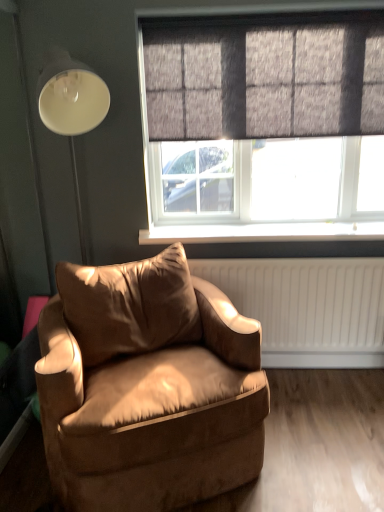
Find the location of a particular element. Image resolution: width=384 pixels, height=512 pixels. textured gray window at upper center is located at coordinates (265, 136).

The image size is (384, 512). What do you see at coordinates (265, 79) in the screenshot?
I see `dark grey textured curtain at upper center` at bounding box center [265, 79].

Measure the distance between dark grey textured curtain at upper center and camera.

dark grey textured curtain at upper center is 7.21 feet away from camera.

In order to face white plastic window sill at center, should I rotate leftwards or rightwards?

It's best to rotate right around 9.754 degrees.

Identify the location of suede-like brown armchair at lower left. The height and width of the screenshot is (512, 384). (148, 387).

Identify the location of window on the right side of white plastic window sill at center. Image resolution: width=384 pixels, height=512 pixels. (265, 136).

Which object is closer to the camera, white plastic window sill at center or textured gray window at upper center?

textured gray window at upper center is more forward.

From the picture: Can you confirm if white plastic window sill at center is smaller than textured gray window at upper center?

Indeed, white plastic window sill at center has a smaller size compared to textured gray window at upper center.

How distant is white plastic window sill at center from textured gray window at upper center?

A distance of 16.14 inches exists between white plastic window sill at center and textured gray window at upper center.

Are white plastic window sill at center and dark grey textured curtain at upper center making contact?

No, white plastic window sill at center is not touching dark grey textured curtain at upper center.

Which is closer, (150, 244) or (294, 90)?

Positioned in front is point (294, 90).

Between white plastic window sill at center and dark grey textured curtain at upper center, which one is positioned behind?

white plastic window sill at center is behind.

From a real-world perspective, is white plastic window sill at center physically located above or below dark grey textured curtain at upper center?

In terms of real-world spatial position, white plastic window sill at center is below dark grey textured curtain at upper center.

Is textured gray window at upper center taller or shorter than suede-like brown armchair at lower left?

textured gray window at upper center is taller than suede-like brown armchair at lower left.

Is textured gray window at upper center wider or thinner than suede-like brown armchair at lower left?

In the image, textured gray window at upper center appears to be more narrow than suede-like brown armchair at lower left.

Can you tell me how much textured gray window at upper center and suede-like brown armchair at lower left differ in facing direction?

The facing directions of textured gray window at upper center and suede-like brown armchair at lower left are 22.1 degrees apart.

Is textured gray window at upper center far from suede-like brown armchair at lower left?

Actually, textured gray window at upper center and suede-like brown armchair at lower left are a little close together.

Are suede-like brown armchair at lower left and textured gray window at upper center located far from each other?

suede-like brown armchair at lower left is near textured gray window at upper center, not far away.

Looking at this image, from a real-world perspective, is suede-like brown armchair at lower left physically located above or below textured gray window at upper center?

suede-like brown armchair at lower left is situated lower than textured gray window at upper center in the real world.

Does suede-like brown armchair at lower left turn towards textured gray window at upper center?

No, suede-like brown armchair at lower left is not turned towards textured gray window at upper center.

Find the location of `chair on the left side of textured gray window at upper center`. chair on the left side of textured gray window at upper center is located at coordinates (148, 387).

Is point (248, 461) closer to camera compared to point (352, 118)?

Yes, point (248, 461) is closer to viewer.

Between suede-like brown armchair at lower left and dark grey textured curtain at upper center, which one has more height?

suede-like brown armchair at lower left.

Based on the photo, what's the angular difference between suede-like brown armchair at lower left and dark grey textured curtain at upper center's facing directions?

suede-like brown armchair at lower left and dark grey textured curtain at upper center are facing 22.2 degrees away from each other.

From the image's perspective, would you say suede-like brown armchair at lower left is positioned over dark grey textured curtain at upper center?

No, from the image's perspective, suede-like brown armchair at lower left is not over dark grey textured curtain at upper center.

Is textured gray window at upper center situated inside dark grey textured curtain at upper center or outside?

textured gray window at upper center lies outside dark grey textured curtain at upper center.

Between point (177, 219) and point (238, 105), which one is positioned in front?

The point (238, 105) is more forward.

Is textured gray window at upper center smaller than dark grey textured curtain at upper center?

Actually, textured gray window at upper center might be larger than dark grey textured curtain at upper center.

Could you tell me if textured gray window at upper center is facing dark grey textured curtain at upper center?

Yes, textured gray window at upper center is aimed at dark grey textured curtain at upper center.

Between textured gray window at upper center and white plastic window sill at center, which one appears on the left side from the viewer's perspective?

From the viewer's perspective, white plastic window sill at center appears more on the left side.

How different are the orientations of textured gray window at upper center and white plastic window sill at center in degrees?

The facing directions of textured gray window at upper center and white plastic window sill at center are 0.0877 degrees apart.

Is white plastic window sill at center at the back of textured gray window at upper center?

No, textured gray window at upper center is not facing away from white plastic window sill at center.

The width and height of the screenshot is (384, 512). Identify the location of window sill on the left of textured gray window at upper center. (263, 232).

This screenshot has height=512, width=384. Find the location of `window sill behind the textured gray window at upper center`. window sill behind the textured gray window at upper center is located at coordinates (263, 232).

Where is `curtain above the white plastic window sill at center (from a real-world perspective)`? The height and width of the screenshot is (512, 384). curtain above the white plastic window sill at center (from a real-world perspective) is located at coordinates (265, 79).

Looking at the image, which one is located further to dark grey textured curtain at upper center, white plastic window sill at center or suede-like brown armchair at lower left?

Among the two, suede-like brown armchair at lower left is located further to dark grey textured curtain at upper center.

Looking at the image, which one is located further to textured gray window at upper center, dark grey textured curtain at upper center or suede-like brown armchair at lower left?

suede-like brown armchair at lower left is positioned further to the anchor textured gray window at upper center.

Which object lies further to the anchor point textured gray window at upper center, white plastic window sill at center or dark grey textured curtain at upper center?

Based on the image, white plastic window sill at center appears to be further to textured gray window at upper center.

Estimate the real-world distances between objects in this image. Which object is further from white plastic window sill at center, dark grey textured curtain at upper center or textured gray window at upper center?

dark grey textured curtain at upper center is further to white plastic window sill at center.

Which object lies further to the anchor point textured gray window at upper center, white plastic window sill at center or suede-like brown armchair at lower left?

suede-like brown armchair at lower left.

Looking at the image, which one is located further to dark grey textured curtain at upper center, suede-like brown armchair at lower left or textured gray window at upper center?

Based on the image, suede-like brown armchair at lower left appears to be further to dark grey textured curtain at upper center.

Which object lies further to the anchor point suede-like brown armchair at lower left, textured gray window at upper center or dark grey textured curtain at upper center?

dark grey textured curtain at upper center is positioned further to the anchor suede-like brown armchair at lower left.

Which object lies nearer to the anchor point suede-like brown armchair at lower left, dark grey textured curtain at upper center or white plastic window sill at center?

The object closer to suede-like brown armchair at lower left is white plastic window sill at center.

Locate an element on the screen. Image resolution: width=384 pixels, height=512 pixels. window located between suede-like brown armchair at lower left and white plastic window sill at center in the depth direction is located at coordinates (265, 136).

Locate an element on the screen. window sill between dark grey textured curtain at upper center and suede-like brown armchair at lower left vertically is located at coordinates (263, 232).

Where is `window between dark grey textured curtain at upper center and white plastic window sill at center in the vertical direction`? Image resolution: width=384 pixels, height=512 pixels. window between dark grey textured curtain at upper center and white plastic window sill at center in the vertical direction is located at coordinates (265, 136).

Image resolution: width=384 pixels, height=512 pixels. I want to click on window between dark grey textured curtain at upper center and suede-like brown armchair at lower left in the up-down direction, so click(x=265, y=136).